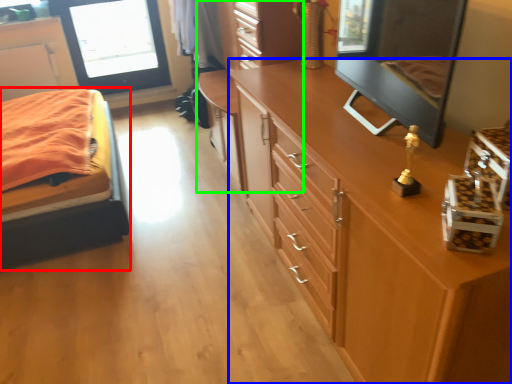
Question: Considering the real-world distances, which object is farthest from bed (highlighted by a red box)? chest of drawers (highlighted by a blue box) or dresser (highlighted by a green box)?

Choices:
 (A) chest of drawers
 (B) dresser

Answer: (A)